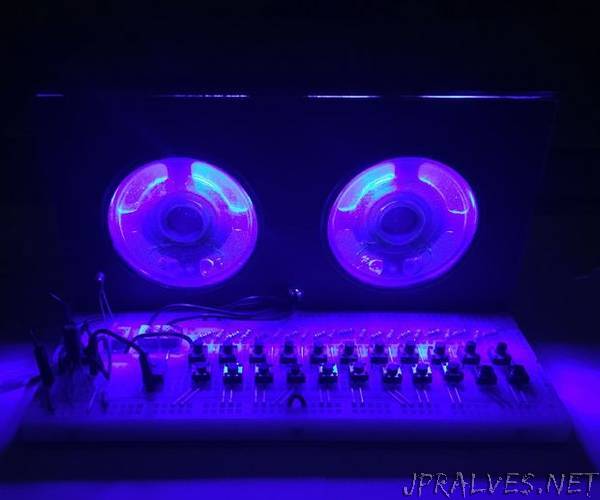
You are a GUI agent. You are given a task and a screenshot of the screen. Output one action in this format:
    pyautogui.click(x=<x>, y=<y>)
    Task: Click on the cables
    
    Given the screenshot: What is the action you would take?
    pyautogui.click(x=203, y=304), pyautogui.click(x=193, y=313), pyautogui.click(x=167, y=333), pyautogui.click(x=116, y=339), pyautogui.click(x=102, y=312), pyautogui.click(x=110, y=311), pyautogui.click(x=111, y=362), pyautogui.click(x=59, y=298), pyautogui.click(x=301, y=397)